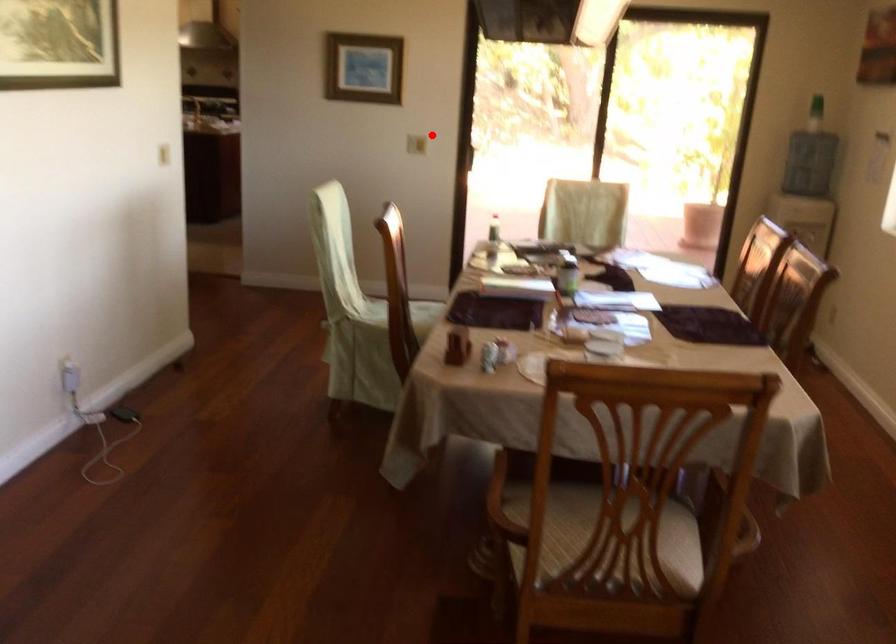
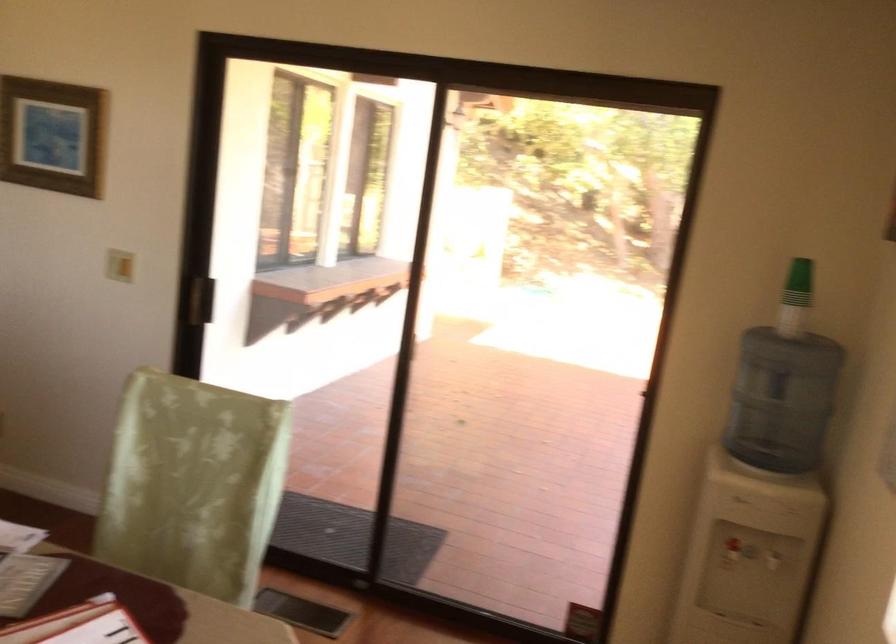
Question: I am providing you with two images of the same scene from different viewpoints. A red point is shown in image1. For the corresponding object point in image2, is it positioned nearer or farther from the camera?

Choices:
 (A) Nearer
 (B) Farther

Answer: (A)